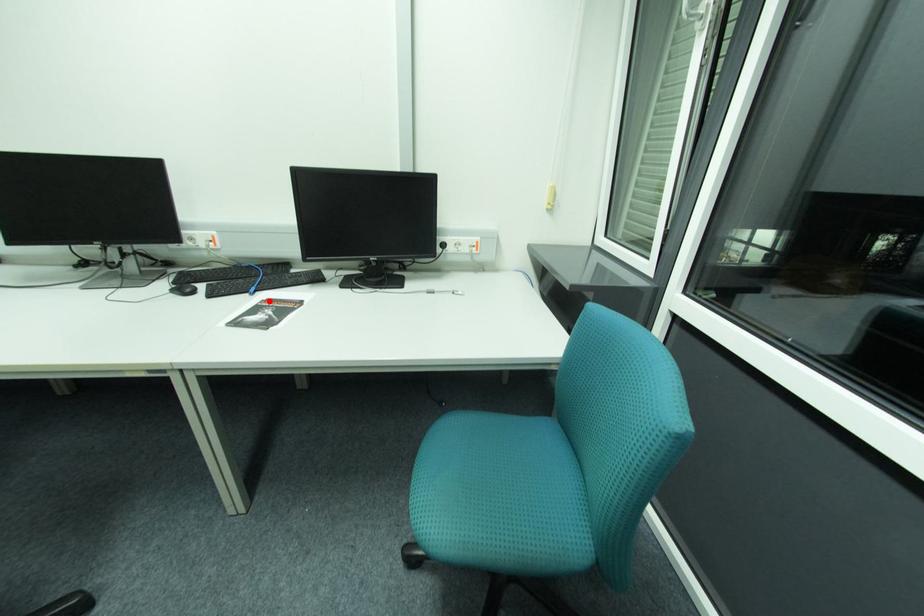
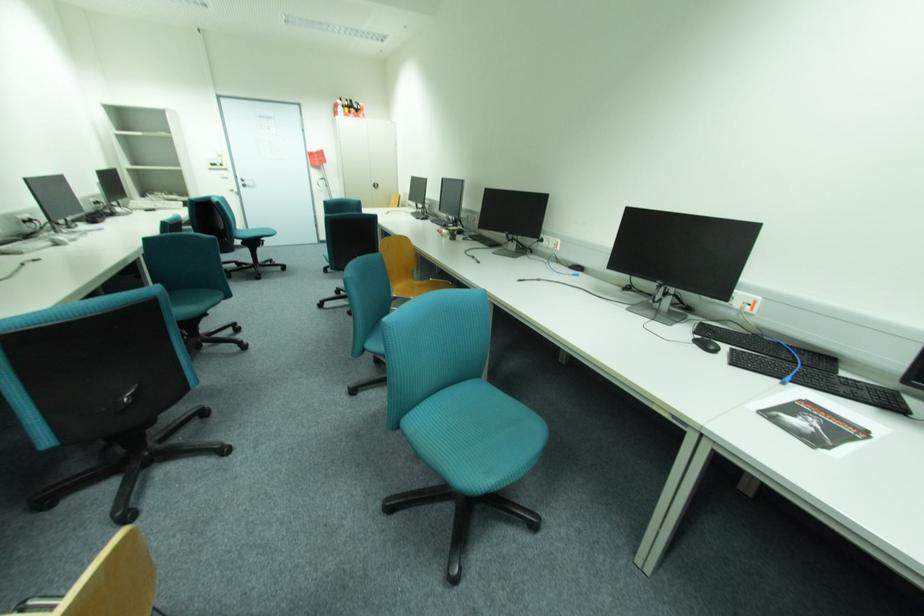
In the second image, find the point that corresponds to the highlighted location in the first image.

(807, 400)